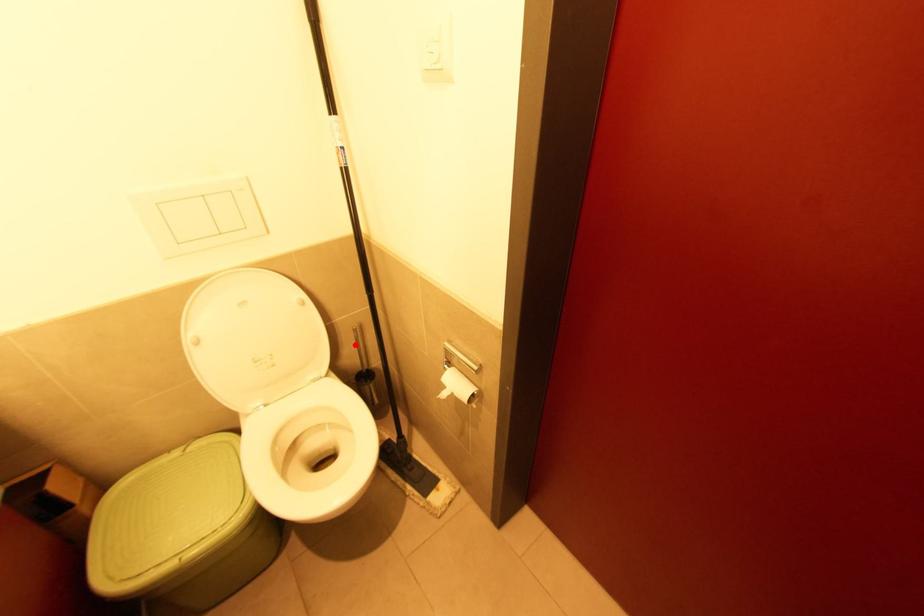
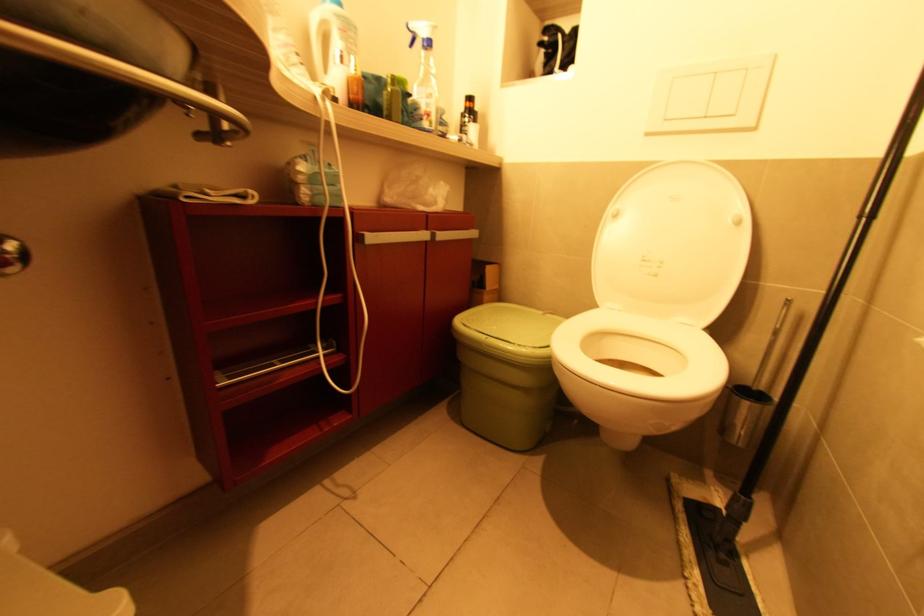
Question: A red point is marked in image1. In image2, is the corresponding 3D point closer to the camera or farther? Reply with the corresponding letter.

Choices:
 (A) The corresponding 3D point is closer.
 (B) The corresponding 3D point is farther.

Answer: (A)